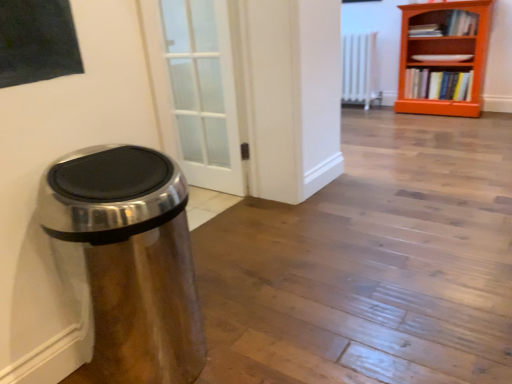
Question: In the image, is satin metallic trash can at left positioned in front of or behind hardcover book at upper right, which is counted as the first book, starting from the top?

Choices:
 (A) front
 (B) behind

Answer: (A)

Question: Is point (91, 241) positioned closer to the camera than point (470, 34)?

Choices:
 (A) closer
 (B) farther

Answer: (A)

Question: Which object is positioned farthest from the satin metallic trash can at left?

Choices:
 (A) white metallic radiator at center
 (B) hardcover book at right, which is the 2th book from top to bottom
 (C) orange wooden bookcase at upper right
 (D) hardcover book at upper right, which is counted as the first book, starting from the top

Answer: (A)

Question: Which is farther from the white metallic radiator at center?

Choices:
 (A) hardcover book at right, which appears as the 1th book when ordered from the bottom
 (B) orange wooden bookcase at upper right
 (C) satin metallic trash can at left
 (D) hardcover book at upper right, the 2th book ordered from the bottom

Answer: (C)